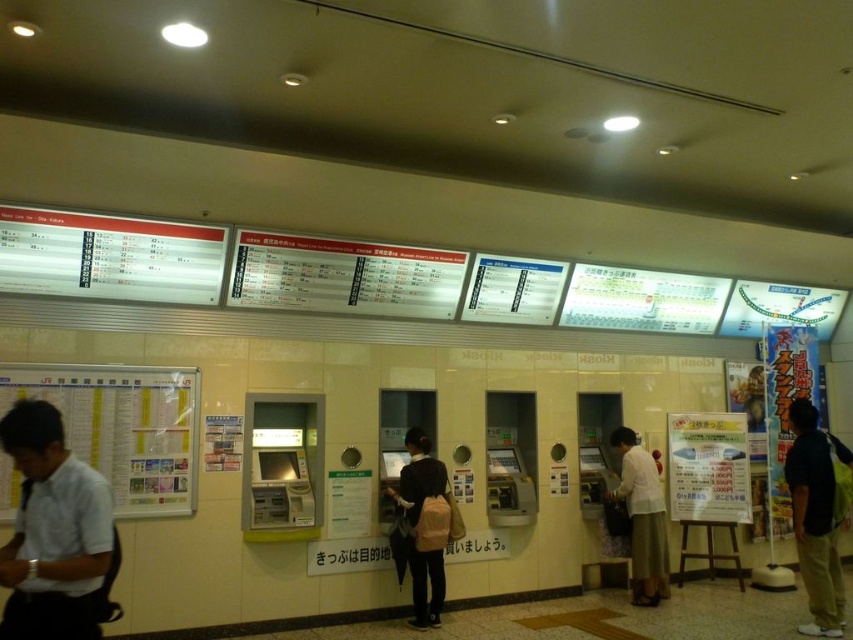
Is point (795, 538) positioned before point (628, 464)?

Yes, it is.

Is dark blue shirt at right further to camera compared to light beige skirt at center?

No, it is in front of light beige skirt at center.

Measure the distance between dark blue shirt at right and camera.

dark blue shirt at right is 16.07 feet away from camera.

Where is `dark blue shirt at right`? This screenshot has height=640, width=853. dark blue shirt at right is located at coordinates (815, 516).

Can you confirm if black matte backpack at center is taller than light beige skirt at center?

No.

The image size is (853, 640). What are the coordinates of `black matte backpack at center` in the screenshot? It's located at pyautogui.click(x=424, y=528).

Between point (405, 500) and point (647, 468), which one is positioned behind?

Positioned behind is point (647, 468).

Identify the location of black matte backpack at center. The width and height of the screenshot is (853, 640). (424, 528).

Between dark blue shirt at right and black matte backpack at center, which one has more height?

Standing taller between the two is dark blue shirt at right.

Is point (828, 628) in front of point (437, 573)?

Yes, it is in front of point (437, 573).

Which is behind, point (827, 468) or point (432, 627)?

The point (432, 627) is more distant.

Where is `dark blue shirt at right`? The width and height of the screenshot is (853, 640). dark blue shirt at right is located at coordinates (815, 516).